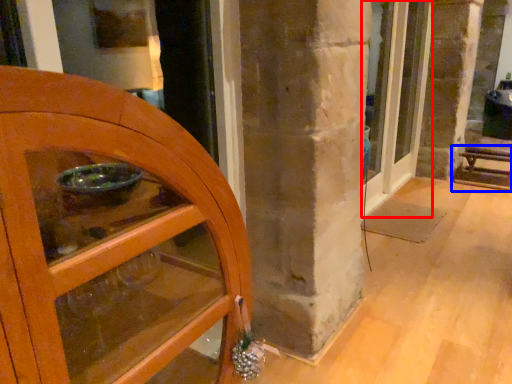
Question: Which of the following is the farthest to the observer, door (highlighted by a red box) or furniture (highlighted by a blue box)?

Choices:
 (A) door
 (B) furniture

Answer: (B)